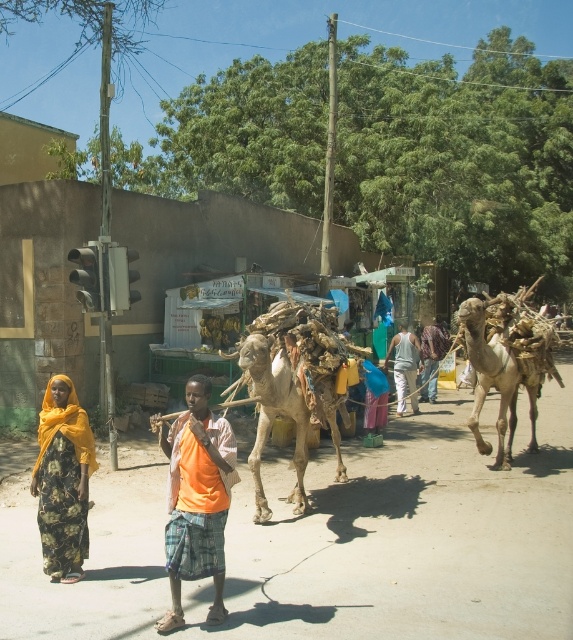
Is point (415, 346) in front of point (431, 372)?

Yes, point (415, 346) is closer to viewer.

Is point (386, 369) more distant than point (430, 397)?

Yes.

Find the location of a particular element. light gray cotton tank top at center is located at coordinates (405, 365).

Is point (489, 372) closer to viewer compared to point (425, 388)?

Yes, it is in front of point (425, 388).

Measure the distance between brown textured camel at right and camera.

brown textured camel at right is 9.41 meters away from camera.

In order to click on brown textured camel at right in this screenshot , I will do `click(505, 364)`.

Does orange fabric at center have a greater width compared to light beige textured camel at center?

No, orange fabric at center is not wider than light beige textured camel at center.

Can you confirm if orange fabric at center is shorter than light beige textured camel at center?

Correct, orange fabric at center is not as tall as light beige textured camel at center.

Is point (170, 566) farther from camera compared to point (339, 468)?

No, (170, 566) is in front of (339, 468).

You are a GUI agent. You are given a task and a screenshot of the screen. Output one action in this format:
    pyautogui.click(x=<x>, y=<y>)
    Task: Click on the orange fabric at center
    
    Given the screenshot: What is the action you would take?
    pyautogui.click(x=197, y=499)